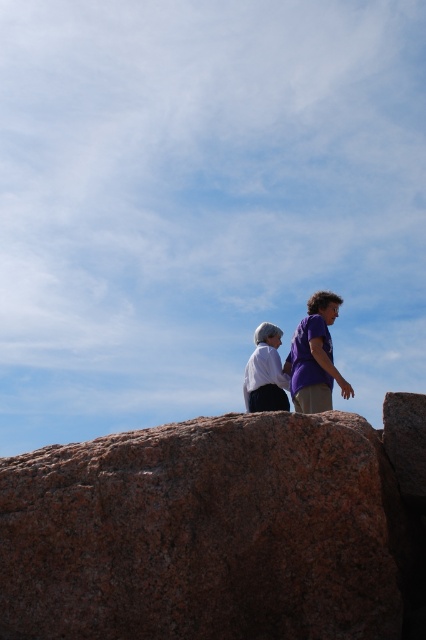
You are planning to place a small picnic basket on the granite rock at center. Considering the size of the purple matte shirt at center, will the basket fit on the rock without overlapping the shirt?

The granite rock at center is wider than the purple matte shirt at center, so the picnic basket should fit on the rock without overlapping the shirt.

You are standing at the point with coordinates point (325,410) and want to walk towards the point with coordinates point (324,604). Given the scene described, can you determine if your path is clear of any obstacles between these two points?

Point (324,604) is in front of point (325,410), so the path between them is clear of obstacles.